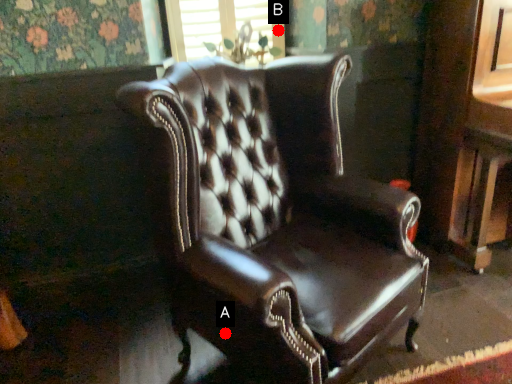
Question: Two points are circled on the image, labeled by A and B beside each circle. Which point is closer to the camera?

Choices:
 (A) A is closer
 (B) B is closer

Answer: (A)